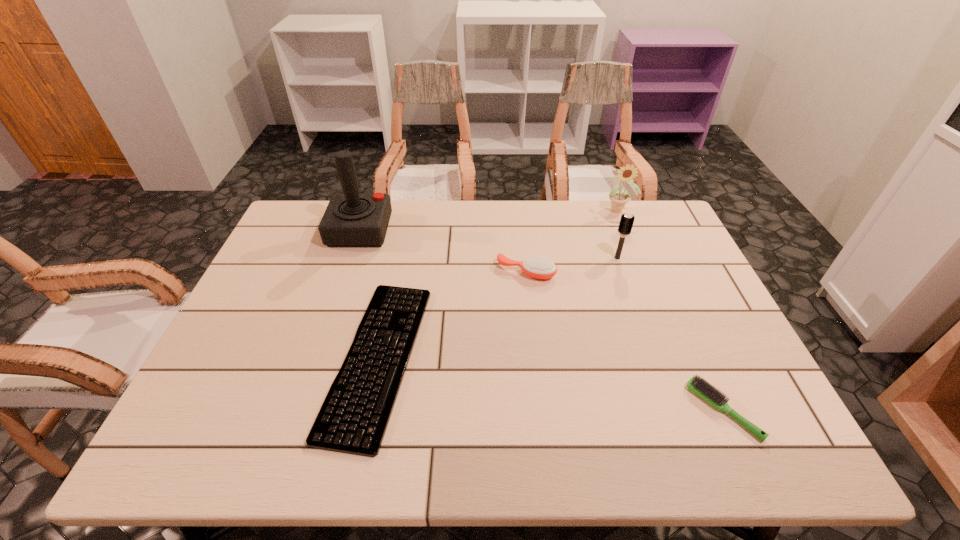
At what (x,y) coordinates should I click in order to perform the action: click on sunflower that is positioned at the right edge. Please return your answer as a coordinate pair (x, y). This screenshot has width=960, height=540. Looking at the image, I should click on (618, 199).

You are a GUI agent. You are given a task and a screenshot of the screen. Output one action in this format:
    pyautogui.click(x=<x>, y=<y>)
    Task: Click on the hairbrush situated at the right edge
    Image resolution: width=960 pixels, height=540 pixels.
    Given the screenshot: What is the action you would take?
    pyautogui.click(x=704, y=389)

The image size is (960, 540). Identify the location of object present at the far left corner. (351, 219).

Locate an element on the screen. Image resolution: width=960 pixels, height=540 pixels. object that is at the far right corner is located at coordinates click(618, 199).

This screenshot has width=960, height=540. In order to click on object situated at the near right corner in this screenshot , I will do `click(704, 389)`.

This screenshot has width=960, height=540. I want to click on vacant region at the far edge of the desktop, so click(x=465, y=228).

Locate an element on the screen. This screenshot has width=960, height=540. blank space at the near edge of the desktop is located at coordinates (298, 429).

This screenshot has height=540, width=960. What are the coordinates of `free point at the left edge` in the screenshot? It's located at (216, 367).

Locate an element on the screen. The height and width of the screenshot is (540, 960). free space at the right edge of the desktop is located at coordinates (702, 362).

In the image, there is a desktop. Identify the location of vacant space at the far left corner. Image resolution: width=960 pixels, height=540 pixels. (282, 234).